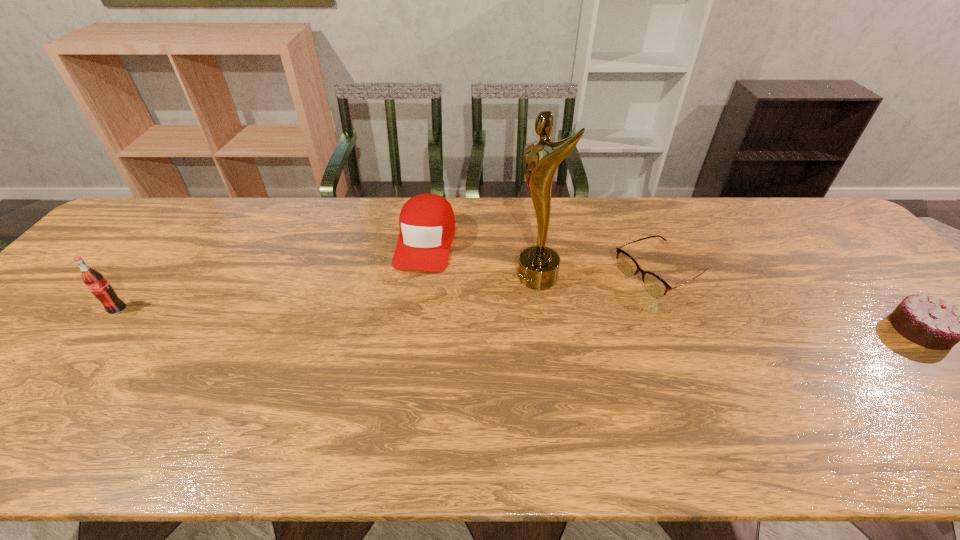
Identify the location of free space at the near edge of the desktop. (714, 381).

Where is `blank space at the left edge`? The image size is (960, 540). blank space at the left edge is located at coordinates (146, 244).

Image resolution: width=960 pixels, height=540 pixels. Find the location of `vacant space at the right edge of the desktop`. vacant space at the right edge of the desktop is located at coordinates (862, 292).

Locate an element on the screen. This screenshot has height=540, width=960. free space at the near left corner of the desktop is located at coordinates (9, 401).

Identify the location of free space between the award and the baseball cap. (481, 259).

Locate an element on the screen. The height and width of the screenshot is (540, 960). empty space that is in between the soda bottle and the award is located at coordinates (327, 293).

The height and width of the screenshot is (540, 960). Find the location of `vacant area between the fourth object from right to left and the third object from left to right`. vacant area between the fourth object from right to left and the third object from left to right is located at coordinates (481, 259).

Image resolution: width=960 pixels, height=540 pixels. Identify the location of vacant space in between the fourth object from right to left and the tallest object. (481, 259).

Locate which object is the fourth closest to the fourth object from right to left. Please provide its 2D coordinates. Your answer should be formatted as a tuple, i.e. [(x, y)], where the tuple contains the x and y coordinates of a point satisfying the conditions above.

[(928, 321)]

Locate an element on the screen. the third closest object to the tallest object is located at coordinates (928, 321).